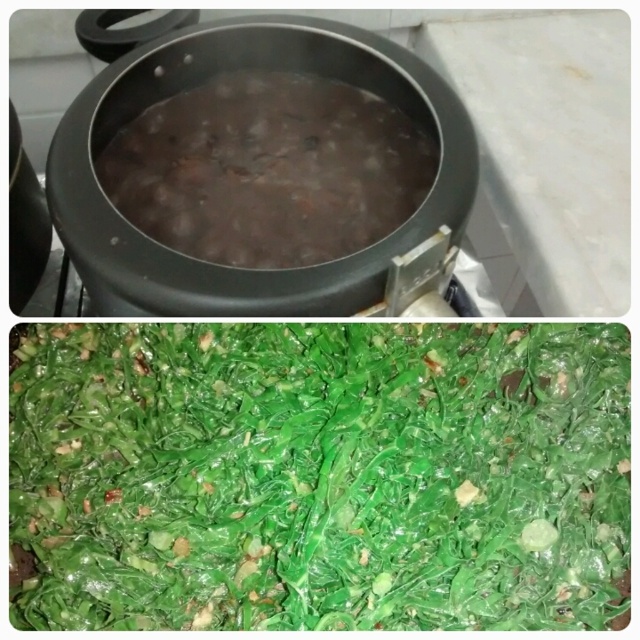
You are a chef holding a wooden spoon. You need to stir the pot in the top section. The spoon is 30 centimeters long. Can you reach the center of the pot from your current position at point (136, 385) without moving your feet?

The distance between you and the center of the pot is 77.58 centimeters. Since your spoon is only 30 centimeters long, you cannot reach the center of the pot without moving your feet.

Based on the photo, you are a chef preparing a soup. You have a glossy green leafy vegetable at center and brown matte beans at center in your pot. Which ingredient is closer to the edge of the pot?

The glossy green leafy vegetable at center and brown matte beans at center are 8.18 inches apart. Without knowing the pot size, we can only state their separation distance.